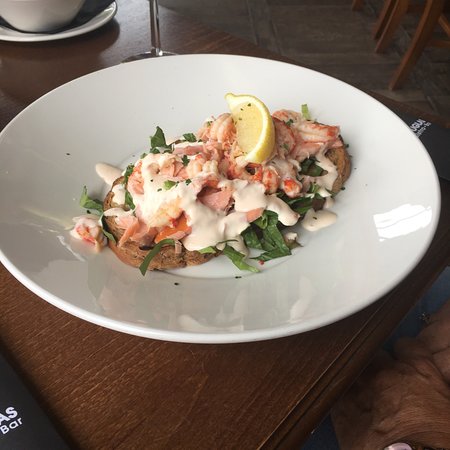
Locate an element on the screen. This screenshot has height=450, width=450. light is located at coordinates (131, 11).